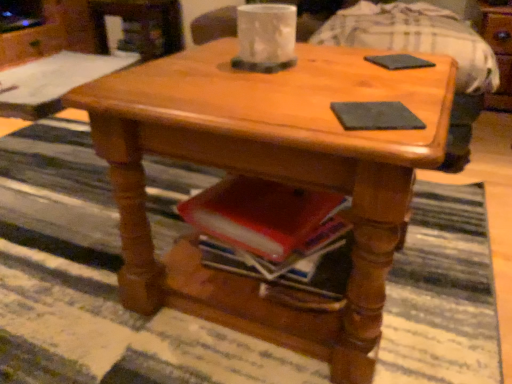
Find the location of a particular element. Image resolution: width=512 pixels, height=384 pixels. free space behind black matte pad at center, marked as the 1th pad in a left-to-right arrangement is located at coordinates (355, 85).